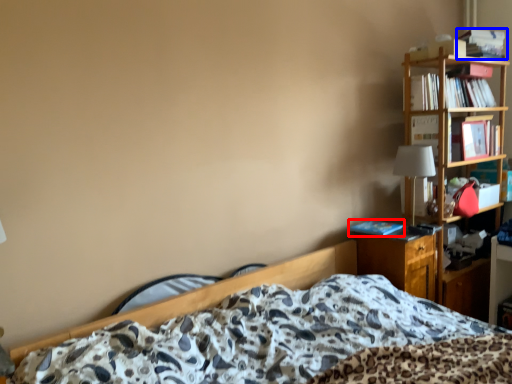
Question: Which object appears farthest to the camera in this image, book (highlighted by a red box) or book (highlighted by a blue box)?

Choices:
 (A) book
 (B) book

Answer: (B)